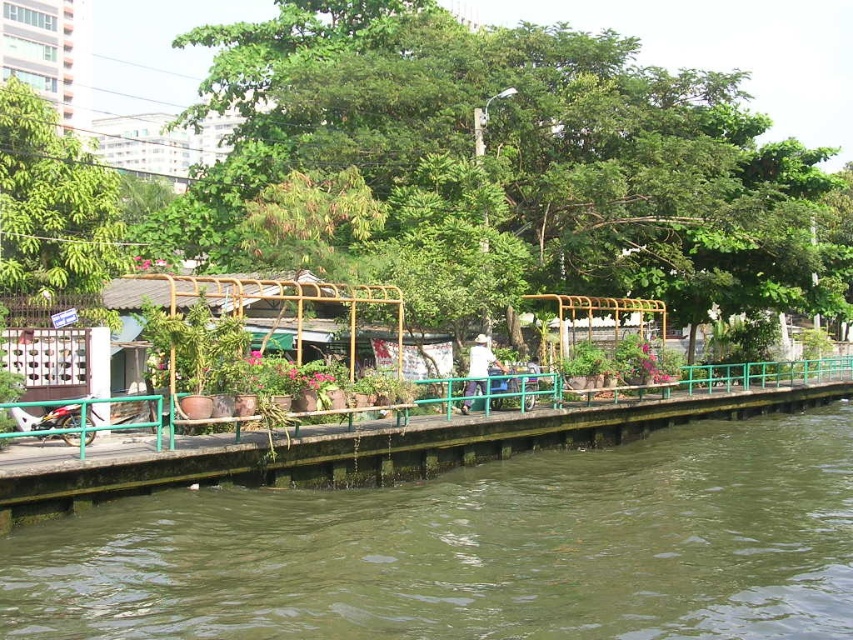
Looking at this image, you are a gardener planning to trim both the green leafy tree at center and the green leafy tree at upper left. Which tree requires more effort due to its size?

The green leafy tree at center requires more effort to trim because it is bigger than the green leafy tree at upper left.